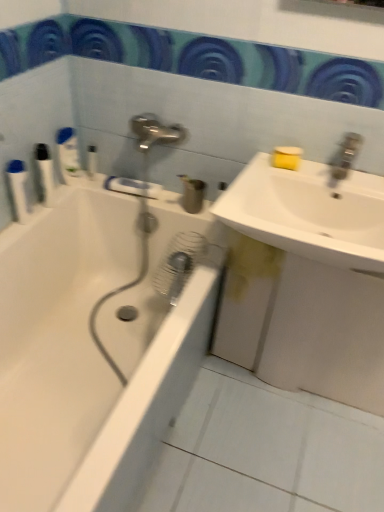
At what (x,y) coordinates should I click in order to perform the action: click on vacant space behind satin nickel faucet at upper right. Please return your answer as a coordinate pair (x, y). This screenshot has height=512, width=384. Looking at the image, I should click on (330, 166).